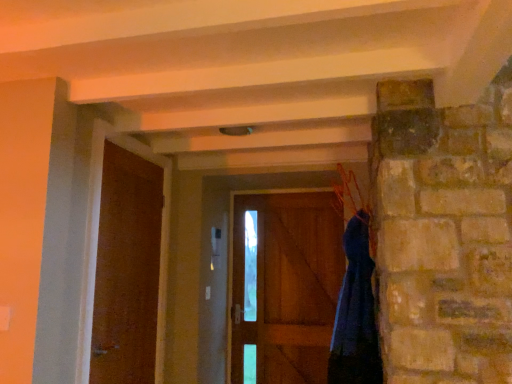
Question: Looking at their shapes, would you say wooden door at left, which is the second door in back-to-front order, is wider or thinner than dark blue fabric at right?

Choices:
 (A) wide
 (B) thin

Answer: (B)

Question: Is point (137, 157) closer or farther from the camera than point (352, 364)?

Choices:
 (A) farther
 (B) closer

Answer: (A)

Question: Which object is positioned closest to the brown wooden door at center, arranged as the second door when viewed from the left?

Choices:
 (A) wooden door at left, which is counted as the first door, starting from the left
 (B) blue fabric hanger at upper right
 (C) dark blue fabric at right

Answer: (B)

Question: Which object is the farthest from the brown wooden door at center, arranged as the second door when viewed from the left?

Choices:
 (A) blue fabric hanger at upper right
 (B) dark blue fabric at right
 (C) wooden door at left, marked as the 1th door in a front-to-back arrangement

Answer: (C)